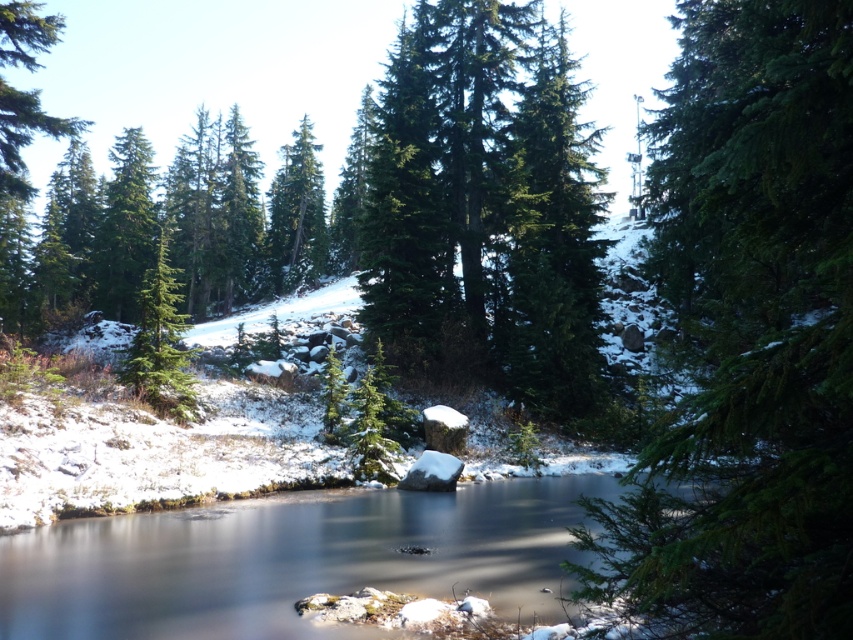
Question: Among these objects, which one is farthest from the camera?

Choices:
 (A) green matte evergreen tree at left
 (B) green matte tree at upper center
 (C) green matte tree at upper right
 (D) green matte tree at center

Answer: (D)

Question: Is green matte tree at upper center wider than green matte evergreen tree at left?

Choices:
 (A) yes
 (B) no

Answer: (A)

Question: Which object is closer to the camera taking this photo?

Choices:
 (A) green matte evergreen tree at left
 (B) green matte tree at upper center

Answer: (A)

Question: Does green matte tree at upper left have a smaller size compared to green matte tree at center?

Choices:
 (A) yes
 (B) no

Answer: (B)

Question: Which point appears farthest from the camera in this image?

Choices:
 (A) (782, 285)
 (B) (173, 378)
 (C) (543, 532)

Answer: (B)

Question: Can you confirm if green matte tree at upper right is bigger than green matte tree at upper left?

Choices:
 (A) yes
 (B) no

Answer: (B)